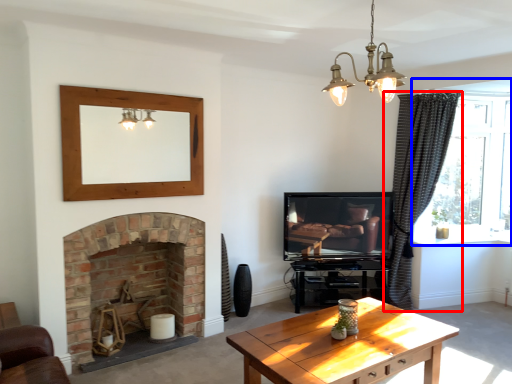
Question: Among these objects, which one is nearest to the camera, curtain (highlighted by a red box) or window (highlighted by a blue box)?

Choices:
 (A) curtain
 (B) window

Answer: (A)